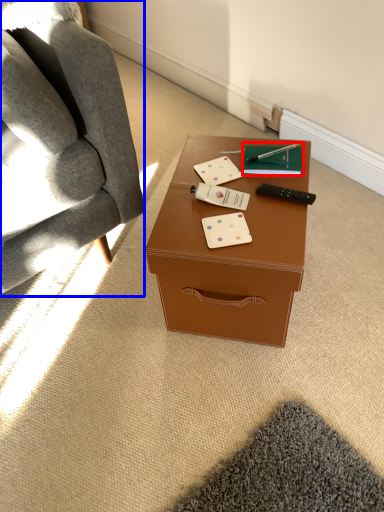
Question: Which of the following is the closest to the observer, notebook (highlighted by a red box) or chair (highlighted by a blue box)?

Choices:
 (A) notebook
 (B) chair

Answer: (B)